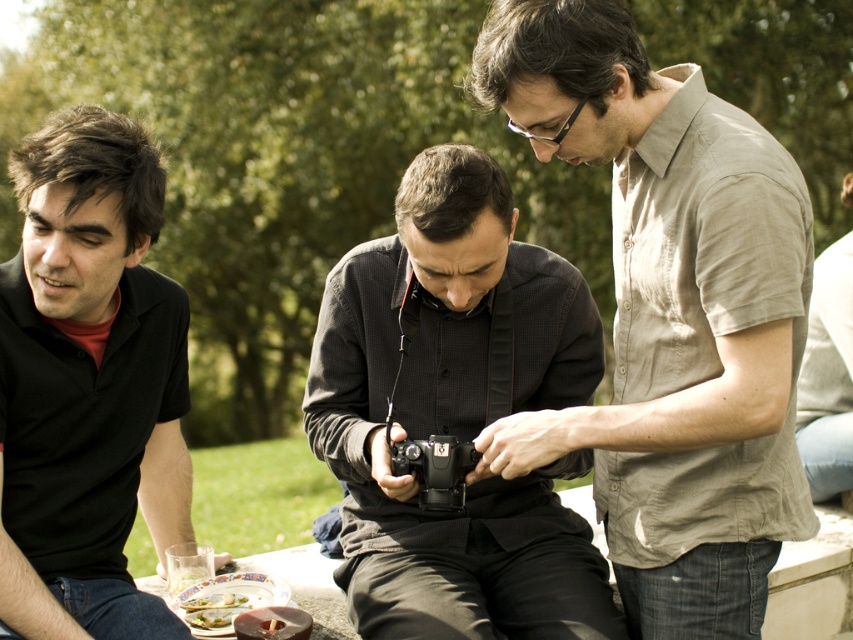
You are a photographer standing in front of the scene. You want to take a photo that includes both the green leafy vegetable at lower left and the green leafy salad at lower center. Which object should you position closer to the bottom of the frame to ensure both are visible?

To include both the green leafy vegetable at lower left and the green leafy salad at lower center in the photo, position the green leafy salad at lower center closer to the bottom of the frame since it is located below the green leafy vegetable at lower left.